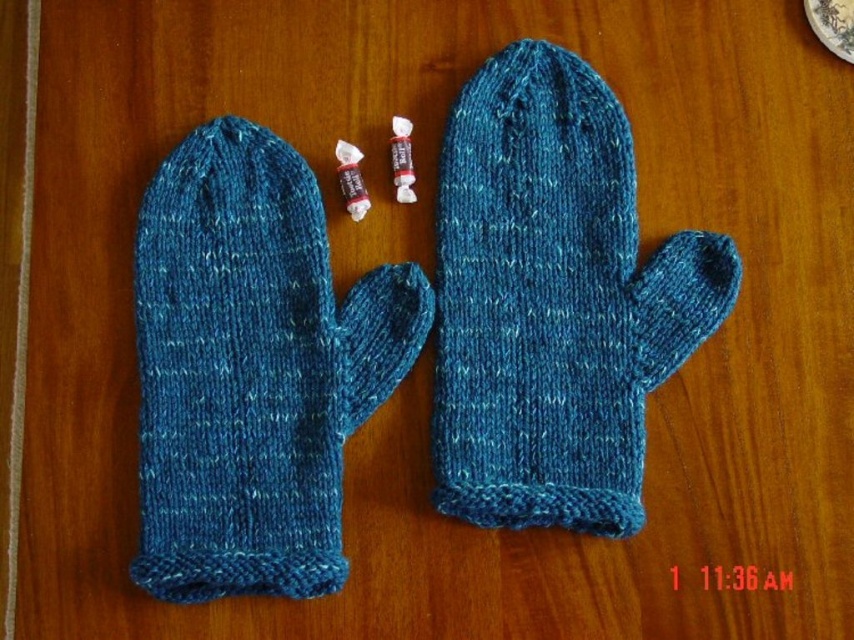
You are trying to choose a pair of mittens to wear. You have a hand that is slightly smaller than average. Which mitten from the image would be more comfortable for you, the teal knitted mitten at center or the blue knitted mitten at left?

The teal knitted mitten at center is smaller than the blue knitted mitten at left, so the teal knitted mitten at center would be more comfortable for your smaller hand.

You are organizing a winter gift basket and need to place the teal knitted mitten at center and the blue knitted mitten at left into a narrow box. Which mitten should you place first to ensure both fit properly?

The blue knitted mitten at left is behind the teal knitted mitten at center, so you should place the teal knitted mitten at center first to make space for the blue one behind it.